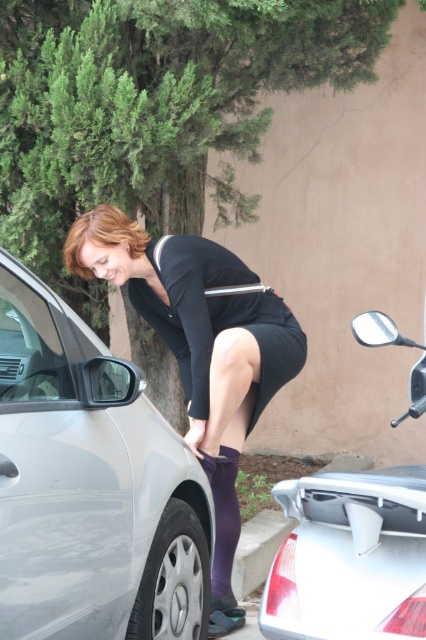
You are a photographer trying to capture a clear shot of the matte black dress at center and the silver metallic car at lower right. Which object appears closer to you in the image?

The matte black dress at center appears closer to you because it is further to the viewer than the silver metallic car at lower right.

You are a delivery person who needs to park your bike between the satin silver car at left and the silver metallic car at lower right. The bike requires 60 centimeters of space. Can you fit it there?

The satin silver car at left is 70.67 centimeters away from the silver metallic car at lower right, which is more than enough space to fit a bike requiring 60 centimeters of space between them.